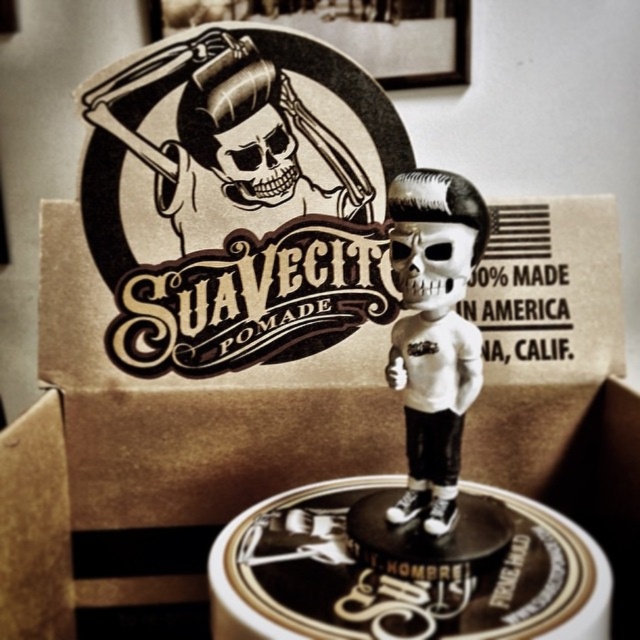
You are a delivery person who needs to place a new package that is 12 inches long into the available space between the brown cardboard box at upper center and the matte black skull at center. Will the package fit in that space?

The distance between the brown cardboard box at upper center and the matte black skull at center is 11.99 inches. Since the package is 12 inches long, it will not fit in the available space as it is slightly longer than the gap.

You are a store manager who wants to ensure proper spacing between the white matte skull at center and the matte black skull at center on the Suavecito Pomade display. According to the display guidelines, the minimum required distance between these two skulls is 2 inches. Is the current spacing compliant with the guidelines?

The distance between the white matte skull at center and the matte black skull at center is 1.94 inches, which is less than the required 2 inches. Therefore, the current spacing does not comply with the guidelines.

Based on the scene description, where is the white matte skull at center located in terms of coordinates?

The white matte skull at center is located at coordinates point (433, 332).